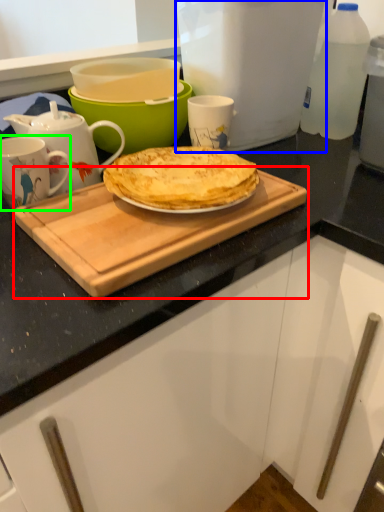
Question: Estimate the real-world distances between objects in this image. Which object is closer to cutting board (highlighted by a red box), kitchen appliance (highlighted by a blue box) or coffee cup (highlighted by a green box)?

Choices:
 (A) kitchen appliance
 (B) coffee cup

Answer: (B)